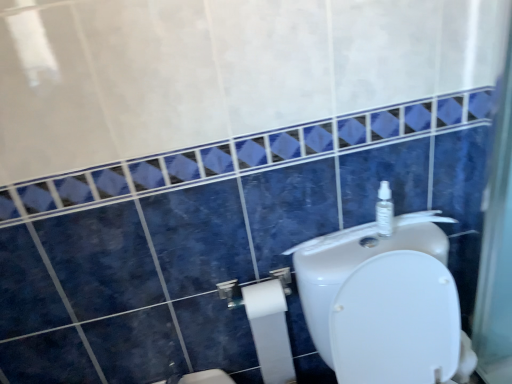
Question: Considering the relative sizes of clear plastic spray bottle at upper right and white matte toilet paper at lower center in the image provided, is clear plastic spray bottle at upper right shorter than white matte toilet paper at lower center?

Choices:
 (A) no
 (B) yes

Answer: (B)

Question: Is clear plastic spray bottle at upper right at the left side of white matte toilet paper at lower center?

Choices:
 (A) yes
 (B) no

Answer: (B)

Question: Are clear plastic spray bottle at upper right and white matte toilet paper at lower center making contact?

Choices:
 (A) no
 (B) yes

Answer: (A)

Question: From the image's perspective, is clear plastic spray bottle at upper right located above white matte toilet paper at lower center?

Choices:
 (A) no
 (B) yes

Answer: (B)

Question: From a real-world perspective, does clear plastic spray bottle at upper right stand above white matte toilet paper at lower center?

Choices:
 (A) no
 (B) yes

Answer: (B)

Question: From the image's perspective, is white glossy toilet at upper right located above or below clear plastic spray bottle at upper right?

Choices:
 (A) above
 (B) below

Answer: (B)

Question: Would you say white glossy toilet at upper right is inside or outside clear plastic spray bottle at upper right?

Choices:
 (A) outside
 (B) inside

Answer: (A)

Question: Does point (379, 238) appear closer or farther from the camera than point (381, 190)?

Choices:
 (A) closer
 (B) farther

Answer: (B)

Question: In terms of width, does white glossy toilet at upper right look wider or thinner when compared to clear plastic spray bottle at upper right?

Choices:
 (A) thin
 (B) wide

Answer: (B)

Question: From a real-world perspective, is clear plastic spray bottle at upper right positioned above or below white glossy toilet at upper right?

Choices:
 (A) below
 (B) above

Answer: (B)

Question: Is clear plastic spray bottle at upper right in front of or behind white glossy toilet at upper right in the image?

Choices:
 (A) front
 (B) behind

Answer: (B)

Question: From their relative heights in the image, would you say clear plastic spray bottle at upper right is taller or shorter than white glossy toilet at upper right?

Choices:
 (A) short
 (B) tall

Answer: (A)

Question: From the image's perspective, is clear plastic spray bottle at upper right located above or below white glossy toilet at upper right?

Choices:
 (A) above
 (B) below

Answer: (A)

Question: From the image's perspective, is white glossy toilet at upper right above or below white matte toilet paper at lower center?

Choices:
 (A) below
 (B) above

Answer: (A)

Question: From a real-world perspective, is white glossy toilet at upper right above or below white matte toilet paper at lower center?

Choices:
 (A) below
 (B) above

Answer: (A)